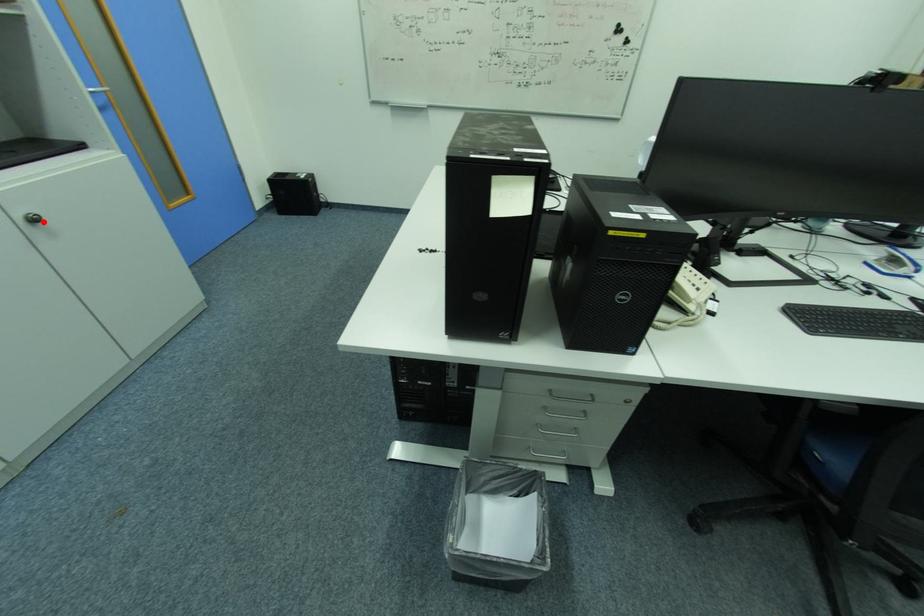
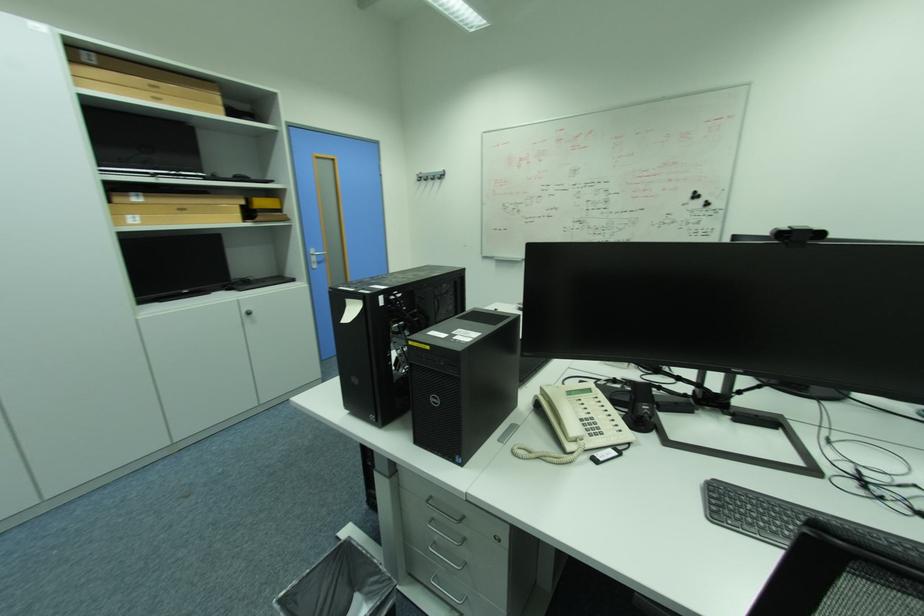
Question: A red point is marked in image1. In image2, is the corresponding 3D point closer to the camera or farther? Reply with the corresponding letter.

Choices:
 (A) The corresponding 3D point is closer.
 (B) The corresponding 3D point is farther.

Answer: (A)